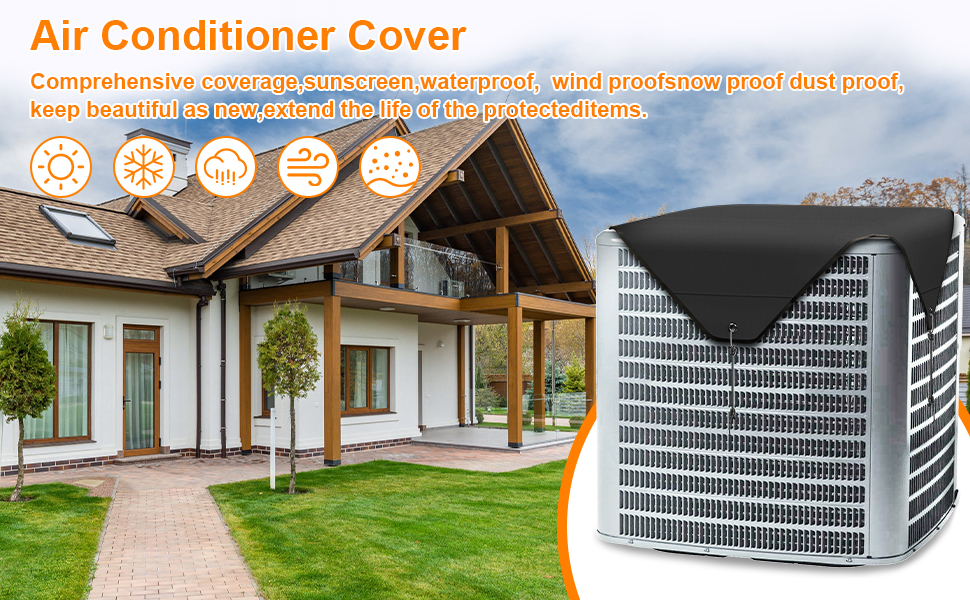
At what (x,y) coordinates should I click in order to perform the action: click on exposed rafter end. Please return your answer as a coordinate pair (x, y). The height and width of the screenshot is (600, 970). Looking at the image, I should click on (458, 178).